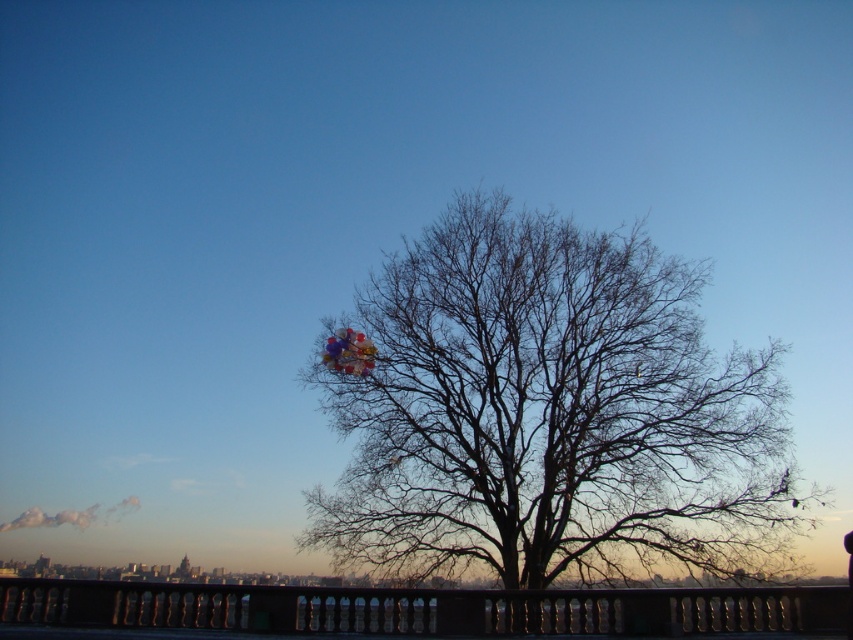
Between black metal railing at lower center and multicolored glossy balloons at center, which one is positioned higher?

multicolored glossy balloons at center is above.

Is point (300, 612) less distant than point (360, 337)?

Yes, it is in front of point (360, 337).

Between point (549, 598) and point (366, 340), which one is positioned in front?

Positioned in front is point (549, 598).

Image resolution: width=853 pixels, height=640 pixels. What are the coordinates of `black metal railing at lower center` in the screenshot? It's located at (422, 609).

Does bare branches at center appear on the left side of multicolored glossy balloons at center?

Incorrect, bare branches at center is not on the left side of multicolored glossy balloons at center.

Does point (497, 396) lie behind point (352, 371)?

Yes.

The image size is (853, 640). I want to click on bare branches at center, so click(549, 412).

Between point (361, 552) and point (93, 605), which one is positioned behind?

The point (361, 552) is behind.

Does bare branches at center have a larger size compared to black metal railing at lower center?

Indeed, bare branches at center has a larger size compared to black metal railing at lower center.

From the picture: Who is more distant from viewer, (383, 516) or (16, 616)?

The point (383, 516) is more distant.

This screenshot has height=640, width=853. I want to click on bare branches at center, so click(549, 412).